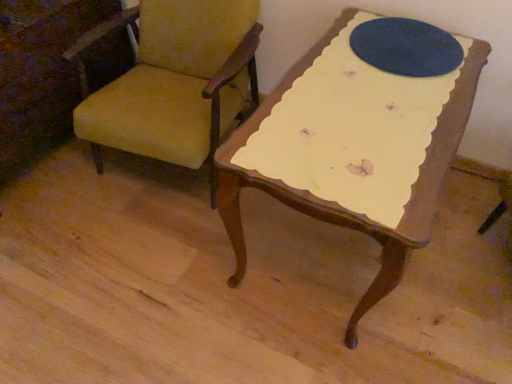
This screenshot has height=384, width=512. Find the location of `yellow fabric chair at upper left`. yellow fabric chair at upper left is located at coordinates (174, 81).

This screenshot has height=384, width=512. Describe the element at coordinates (174, 81) in the screenshot. I see `yellow fabric chair at upper left` at that location.

Locate an element on the screen. This screenshot has width=512, height=384. blue felt oval at upper center is located at coordinates (406, 47).

What do you see at coordinates (406, 47) in the screenshot? I see `blue felt oval at upper center` at bounding box center [406, 47].

Image resolution: width=512 pixels, height=384 pixels. Identify the location of yellow fabric chair at upper left. point(174,81).

In the scene shown: Between yellow fabric chair at upper left and blue felt oval at upper center, which one appears on the left side from the viewer's perspective?

Positioned to the left is yellow fabric chair at upper left.

Is yellow fabric chair at upper left in front of blue felt oval at upper center?

Yes, it is.

Is point (162, 34) closer or farther from the camera than point (375, 20)?

Clearly, point (162, 34) is more distant from the camera than point (375, 20).

From the image's perspective, is yellow fabric chair at upper left on blue felt oval at upper center?

Incorrect, from the image's perspective, yellow fabric chair at upper left is lower than blue felt oval at upper center.

From a real-world perspective, is yellow fabric chair at upper left above or below blue felt oval at upper center?

yellow fabric chair at upper left is below blue felt oval at upper center.

Between yellow fabric chair at upper left and blue felt oval at upper center, which one has larger width?

yellow fabric chair at upper left.

Consider the image. Is yellow fabric chair at upper left taller than blue felt oval at upper center?

Correct, yellow fabric chair at upper left is much taller as blue felt oval at upper center.

Does yellow fabric chair at upper left have a larger size compared to blue felt oval at upper center?

Correct, yellow fabric chair at upper left is larger in size than blue felt oval at upper center.

Would you say yellow fabric chair at upper left is outside blue felt oval at upper center?

Yes, yellow fabric chair at upper left is outside of blue felt oval at upper center.

Is there a large distance between yellow fabric chair at upper left and blue felt oval at upper center?

No, yellow fabric chair at upper left is not far from blue felt oval at upper center.

In the scene shown: Is yellow fabric chair at upper left turned away from blue felt oval at upper center?

No, yellow fabric chair at upper left's orientation is not away from blue felt oval at upper center.

Where is `chair that appears in front of the blue felt oval at upper center`? Image resolution: width=512 pixels, height=384 pixels. chair that appears in front of the blue felt oval at upper center is located at coordinates click(x=174, y=81).

Is blue felt oval at upper center to the left or to the right of yellow fabric chair at upper left in the image?

blue felt oval at upper center is to the right of yellow fabric chair at upper left.

Does blue felt oval at upper center lie in front of yellow fabric chair at upper left?

That is False.

Does point (404, 18) come closer to viewer compared to point (186, 98)?

Yes, it is.

From the image's perspective, who appears lower, blue felt oval at upper center or yellow fabric chair at upper left?

yellow fabric chair at upper left appears lower in the image.

From a real-world perspective, is blue felt oval at upper center on yellow fabric chair at upper left?

Indeed, from a real-world perspective, blue felt oval at upper center stands above yellow fabric chair at upper left.

Considering the relative sizes of blue felt oval at upper center and yellow fabric chair at upper left in the image provided, is blue felt oval at upper center wider than yellow fabric chair at upper left?

No, blue felt oval at upper center is not wider than yellow fabric chair at upper left.

Considering the relative sizes of blue felt oval at upper center and yellow fabric chair at upper left in the image provided, is blue felt oval at upper center shorter than yellow fabric chair at upper left?

Yes, blue felt oval at upper center is shorter than yellow fabric chair at upper left.

Considering the sizes of objects blue felt oval at upper center and yellow fabric chair at upper left in the image provided, who is smaller, blue felt oval at upper center or yellow fabric chair at upper left?

blue felt oval at upper center is smaller.

Is blue felt oval at upper center located outside yellow fabric chair at upper left?

blue felt oval at upper center is positioned outside yellow fabric chair at upper left.

Does blue felt oval at upper center touch yellow fabric chair at upper left?

No, blue felt oval at upper center is not touching yellow fabric chair at upper left.

Is blue felt oval at upper center looking in the opposite direction of yellow fabric chair at upper left?

No, blue felt oval at upper center is not facing the opposite direction of yellow fabric chair at upper left.

This screenshot has height=384, width=512. There is a yellow fabric chair at upper left. Find the location of `oval above it (from a real-world perspective)`. oval above it (from a real-world perspective) is located at coordinates (406, 47).

Image resolution: width=512 pixels, height=384 pixels. Identify the location of chair located underneath the blue felt oval at upper center (from a real-world perspective). (174, 81).

The width and height of the screenshot is (512, 384). I want to click on oval above the yellow fabric chair at upper left (from a real-world perspective), so click(406, 47).